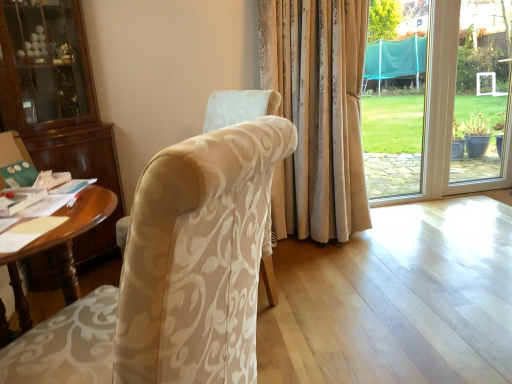
Question: From a real-world perspective, is wooden desk at left positioned above or below beige damask fabric chair at center?

Choices:
 (A) below
 (B) above

Answer: (A)

Question: From the image's perspective, is wooden desk at left located above or below beige damask fabric chair at center?

Choices:
 (A) below
 (B) above

Answer: (A)

Question: Would you say wooden desk at left is to the left or to the right of beige damask fabric chair at center in the picture?

Choices:
 (A) left
 (B) right

Answer: (A)

Question: Choose the correct answer: Is beige damask fabric chair at center inside wooden desk at left or outside it?

Choices:
 (A) inside
 (B) outside

Answer: (B)

Question: Considering the positions of beige damask fabric chair at center and wooden desk at left in the image, is beige damask fabric chair at center bigger or smaller than wooden desk at left?

Choices:
 (A) small
 (B) big

Answer: (A)

Question: Would you say beige damask fabric chair at center is to the left or to the right of wooden desk at left in the picture?

Choices:
 (A) right
 (B) left

Answer: (A)

Question: Is point (217, 218) positioned closer to the camera than point (62, 246)?

Choices:
 (A) closer
 (B) farther

Answer: (A)